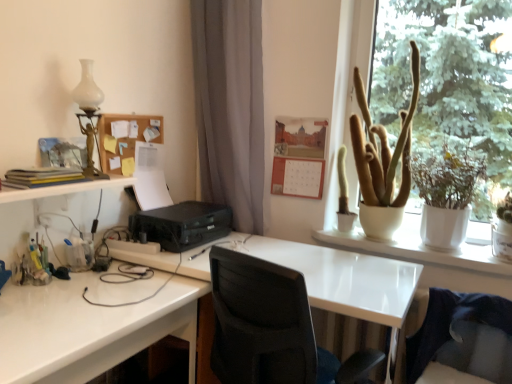
Identify the location of free space above white glossy desk at lower left, the second desk in the right-to-left sequence (from a real-world perspective). (66, 296).